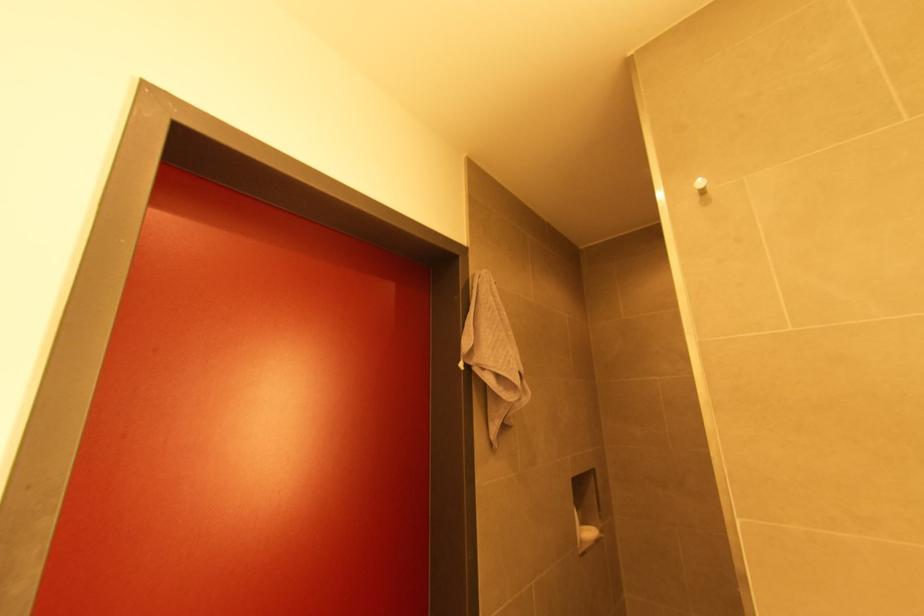
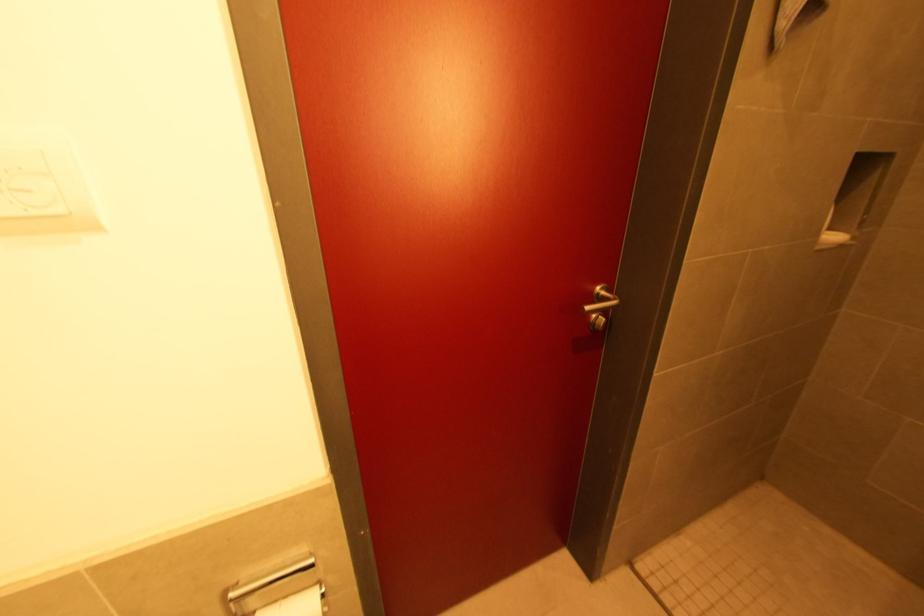
First-person continuous shooting, in which direction is the camera rotating?

The rotation direction of the camera is left-down.